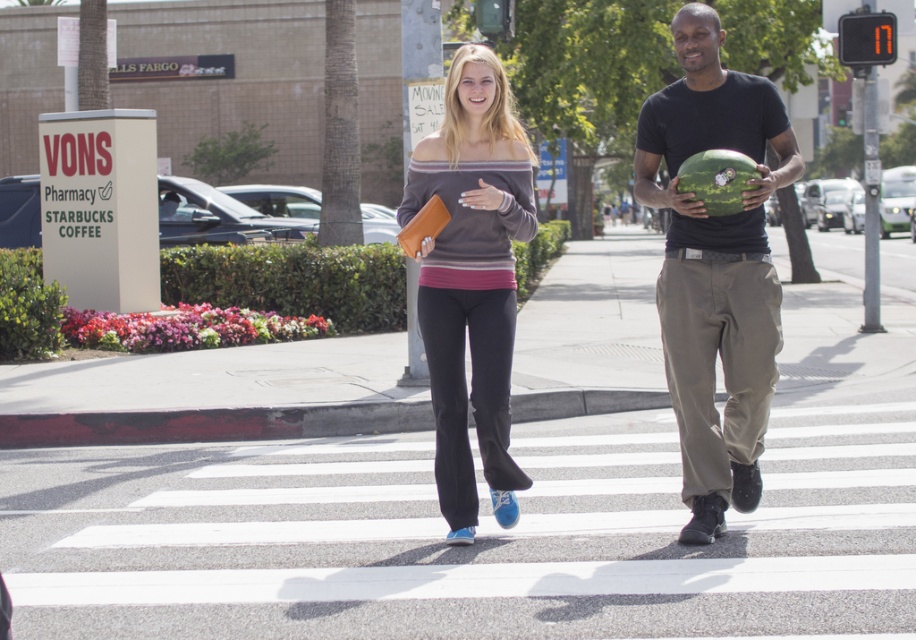
Question: Which object appears farthest from the camera in this image?

Choices:
 (A) matte black shirt at center
 (B) green textured melon at center

Answer: (A)

Question: Is matte black shirt at center thinner than matte gray sweater at center?

Choices:
 (A) no
 (B) yes

Answer: (A)

Question: Is matte black shirt at center positioned in front of green textured melon at center?

Choices:
 (A) yes
 (B) no

Answer: (B)

Question: Is matte black shirt at center further to the viewer compared to green textured melon at center?

Choices:
 (A) no
 (B) yes

Answer: (B)

Question: Which object is closer to the camera taking this photo?

Choices:
 (A) matte gray sweater at center
 (B) matte black shirt at center
 (C) green textured melon at center

Answer: (C)

Question: Among these objects, which one is nearest to the camera?

Choices:
 (A) matte gray sweater at center
 (B) matte black shirt at center

Answer: (B)